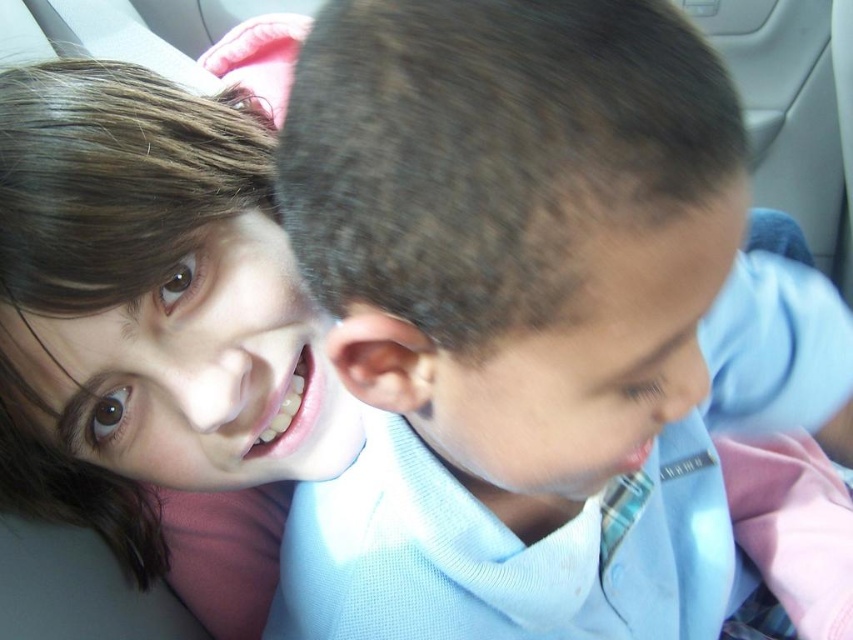
Question: Which point appears closest to the camera in this image?

Choices:
 (A) (247, 352)
 (B) (541, 160)

Answer: (B)

Question: Does light blue shirt at center have a greater width compared to smooth skin face at upper left?

Choices:
 (A) yes
 (B) no

Answer: (A)

Question: Which point appears farthest from the camera in this image?

Choices:
 (A) (265, 205)
 (B) (410, 129)

Answer: (A)

Question: Is light blue shirt at center to the right of smooth skin face at upper left from the viewer's perspective?

Choices:
 (A) yes
 (B) no

Answer: (A)

Question: Does light blue shirt at center have a greater width compared to smooth skin face at upper left?

Choices:
 (A) yes
 (B) no

Answer: (A)